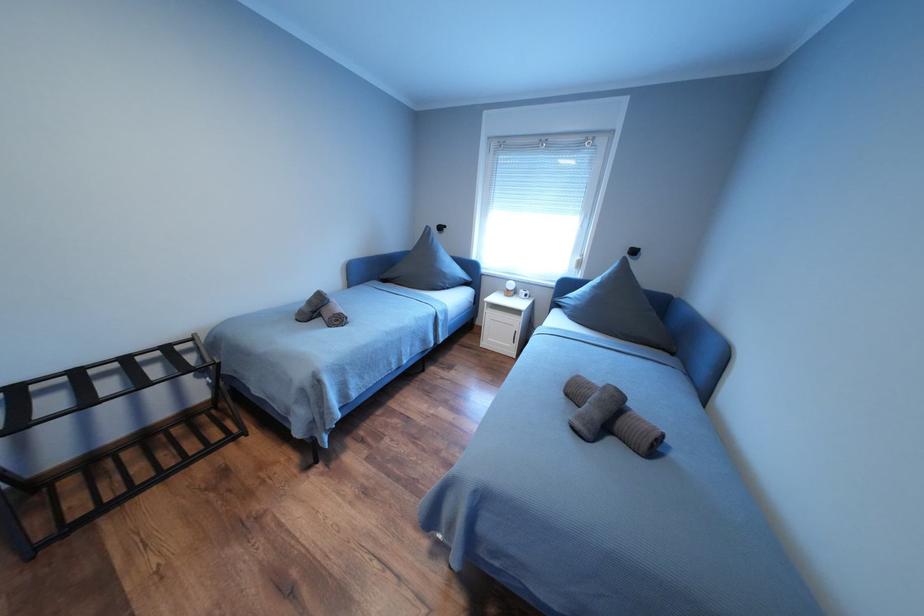
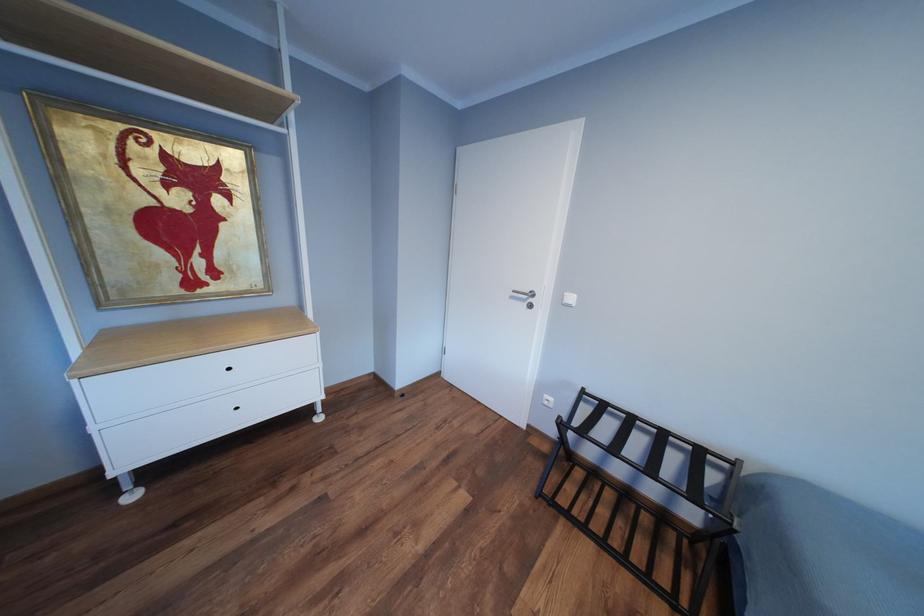
The first image is from the beginning of the video and the second image is from the end. How did the camera likely rotate when shooting the video?

The camera rotated toward left-down.